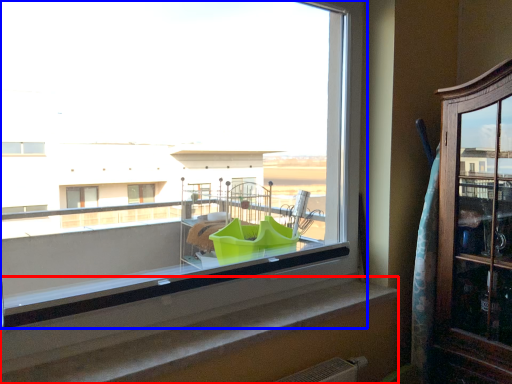
Question: Among these objects, which one is nearest to the camera, window sill (highlighted by a red box) or window (highlighted by a blue box)?

Choices:
 (A) window sill
 (B) window

Answer: (B)